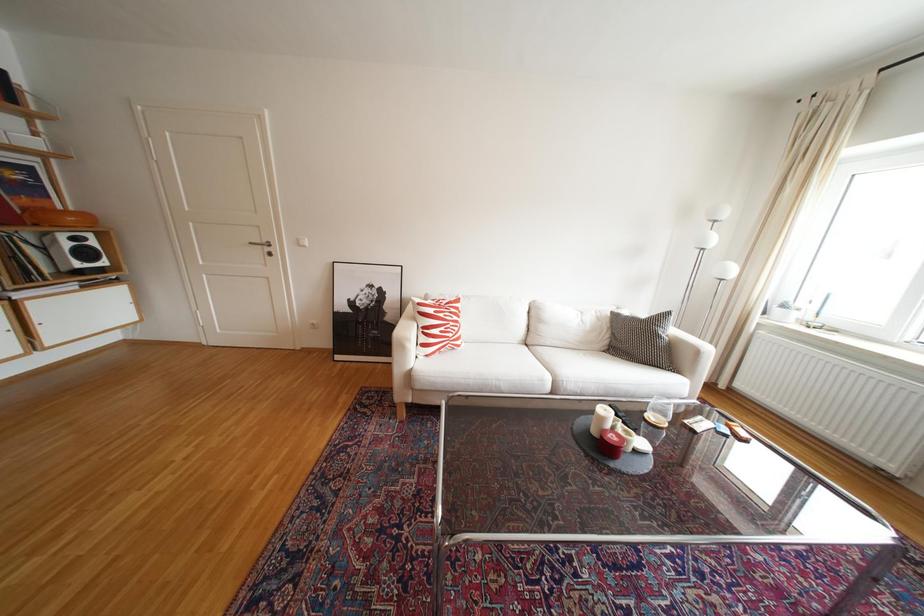
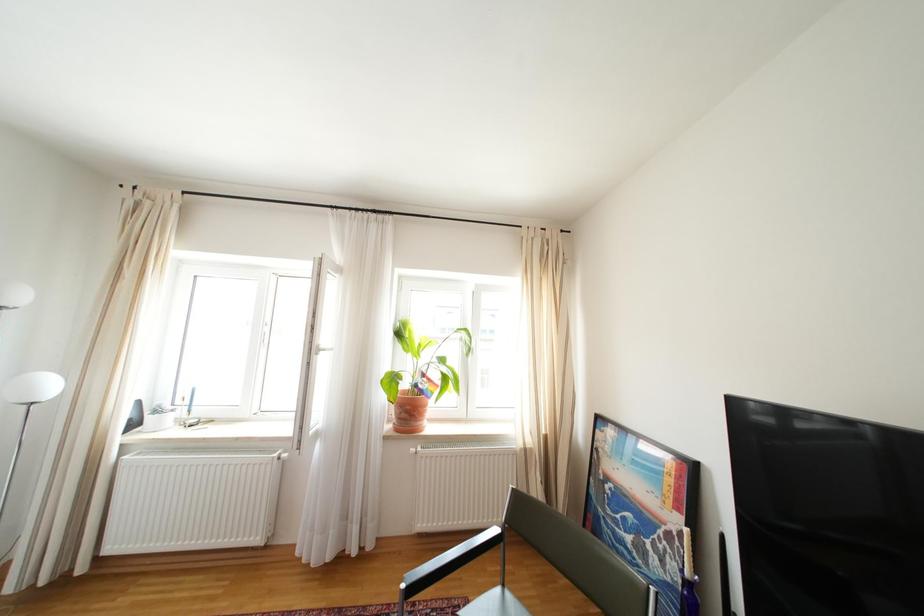
Question: Based on the continuous images, in which direction is the camera rotating? Reply with the corresponding letter.

Choices:
 (A) Left
 (B) Right
 (C) Up
 (D) Down

Answer: (B)